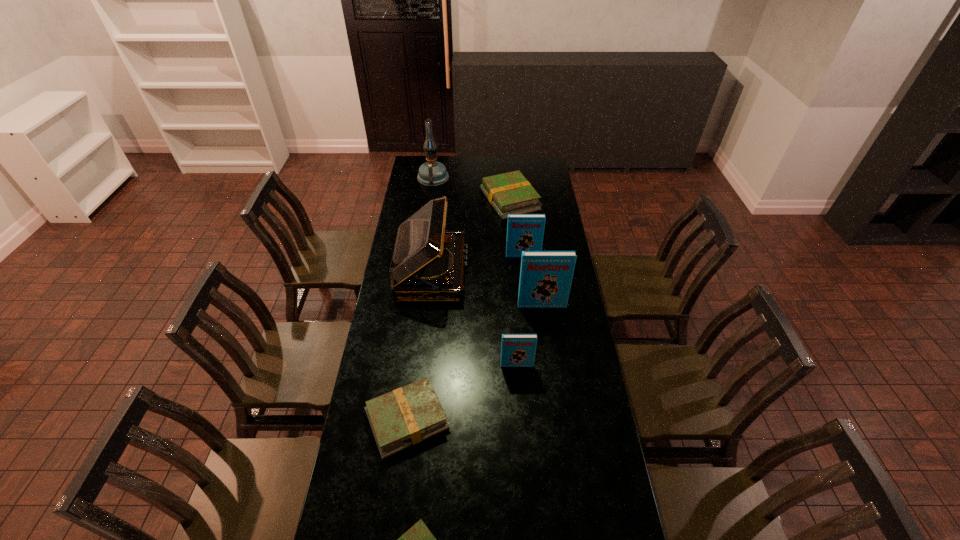
Identify the location of the second farthest yellow book. This screenshot has height=540, width=960. (408, 415).

The image size is (960, 540). Find the location of `the second nearest object`. the second nearest object is located at coordinates (408, 415).

Image resolution: width=960 pixels, height=540 pixels. I want to click on vacant region located on the right of the oil lamp, so click(x=476, y=178).

This screenshot has width=960, height=540. Find the location of `vacant space located 0.110m on the front-facing side of the record player`. vacant space located 0.110m on the front-facing side of the record player is located at coordinates (492, 272).

This screenshot has height=540, width=960. I want to click on blank space located on the front cover of the tallest book, so click(552, 380).

Identify the location of free space located 0.170m on the front cover of the fifth nearest book. Image resolution: width=960 pixels, height=540 pixels. (526, 284).

Where is `vacant space located 0.140m on the front cover of the smallest blue book`? This screenshot has height=540, width=960. vacant space located 0.140m on the front cover of the smallest blue book is located at coordinates (519, 401).

You are a GUI agent. You are given a task and a screenshot of the screen. Output one action in this format:
    pyautogui.click(x=<x>, y=<y>)
    Task: Click on the vacant space located 0.190m on the back of the farthest yellow book
    This screenshot has width=960, height=540.
    Given the screenshot: What is the action you would take?
    pyautogui.click(x=507, y=164)

Where is `blank space located 0.090m on the front of the second nearest yellow book`? blank space located 0.090m on the front of the second nearest yellow book is located at coordinates [398, 489].

The width and height of the screenshot is (960, 540). I want to click on object located in the far edge section of the desktop, so pos(432,173).